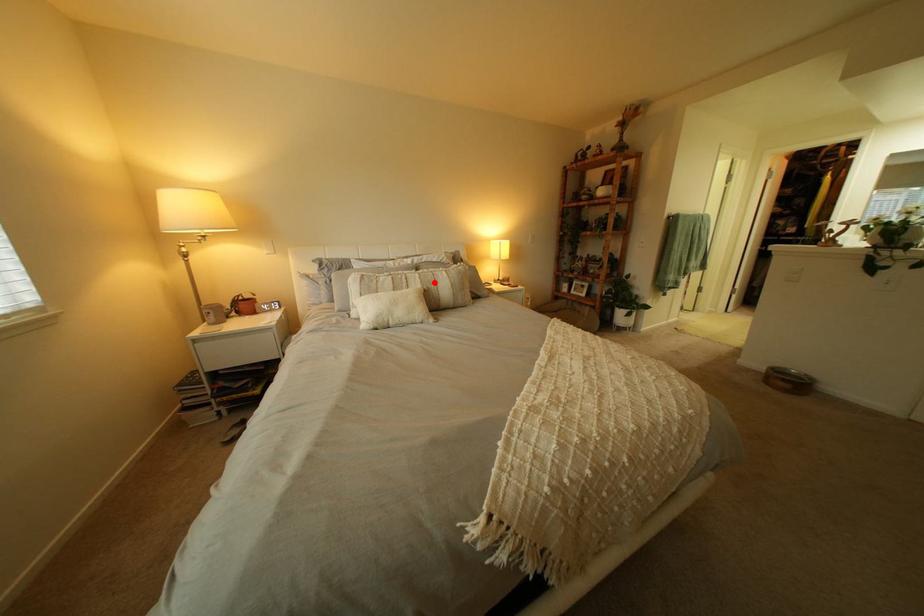
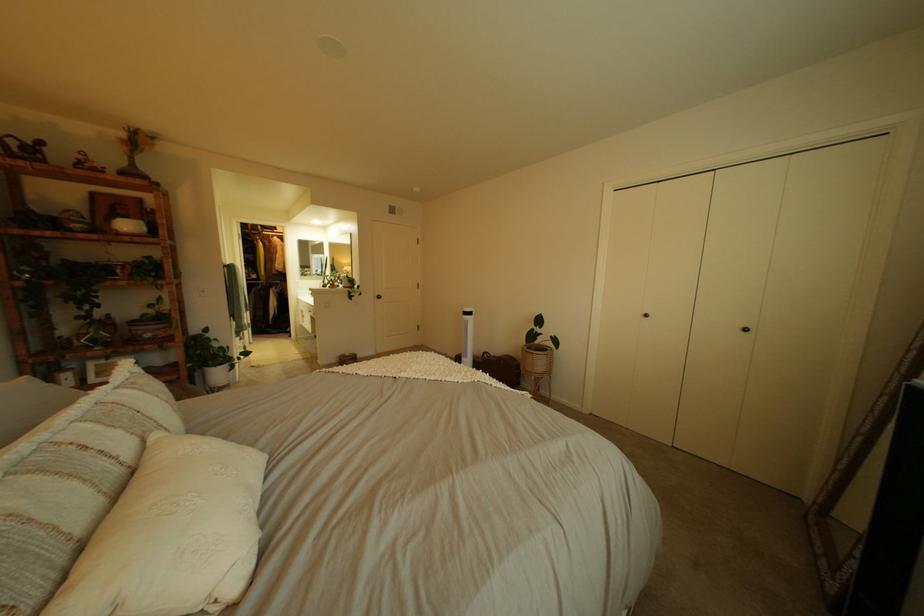
Locate, in the second image, the point that corresponds to the highlighted location in the first image.

(134, 434)